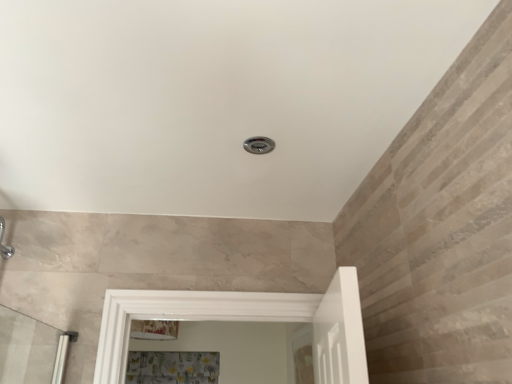
Question: Considering the relative positions of brushed metal shower at center and clear glass screen door at center in the image provided, is brushed metal shower at center to the left of clear glass screen door at center from the viewer's perspective?

Choices:
 (A) no
 (B) yes

Answer: (B)

Question: Is brushed metal shower at center oriented towards clear glass screen door at center?

Choices:
 (A) yes
 (B) no

Answer: (B)

Question: Is the depth of brushed metal shower at center greater than that of clear glass screen door at center?

Choices:
 (A) yes
 (B) no

Answer: (B)

Question: Can clear glass screen door at center be found inside brushed metal shower at center?

Choices:
 (A) yes
 (B) no

Answer: (B)

Question: From a real-world perspective, is brushed metal shower at center under clear glass screen door at center?

Choices:
 (A) yes
 (B) no

Answer: (B)

Question: From a real-world perspective, is brushed metal shower at center on top of clear glass screen door at center?

Choices:
 (A) yes
 (B) no

Answer: (A)

Question: From a real-world perspective, is brushed metal shower at center on floral fabric shower curtain at lower center?

Choices:
 (A) yes
 (B) no

Answer: (A)

Question: Is brushed metal shower at center looking in the opposite direction of floral fabric shower curtain at lower center?

Choices:
 (A) yes
 (B) no

Answer: (B)

Question: Can you confirm if brushed metal shower at center is taller than floral fabric shower curtain at lower center?

Choices:
 (A) yes
 (B) no

Answer: (B)

Question: Is brushed metal shower at center to the left of floral fabric shower curtain at lower center from the viewer's perspective?

Choices:
 (A) no
 (B) yes

Answer: (A)

Question: Is floral fabric shower curtain at lower center inside brushed metal shower at center?

Choices:
 (A) no
 (B) yes

Answer: (A)

Question: Does brushed metal shower at center have a larger size compared to floral fabric shower curtain at lower center?

Choices:
 (A) no
 (B) yes

Answer: (A)

Question: Can you confirm if clear glass screen door at center is wider than floral fabric shower curtain at lower center?

Choices:
 (A) yes
 (B) no

Answer: (B)